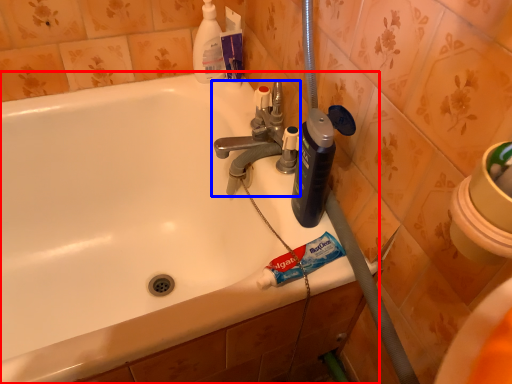
Question: Among these objects, which one is nearest to the camera, bathtub (highlighted by a red box) or tap (highlighted by a blue box)?

Choices:
 (A) bathtub
 (B) tap

Answer: (A)